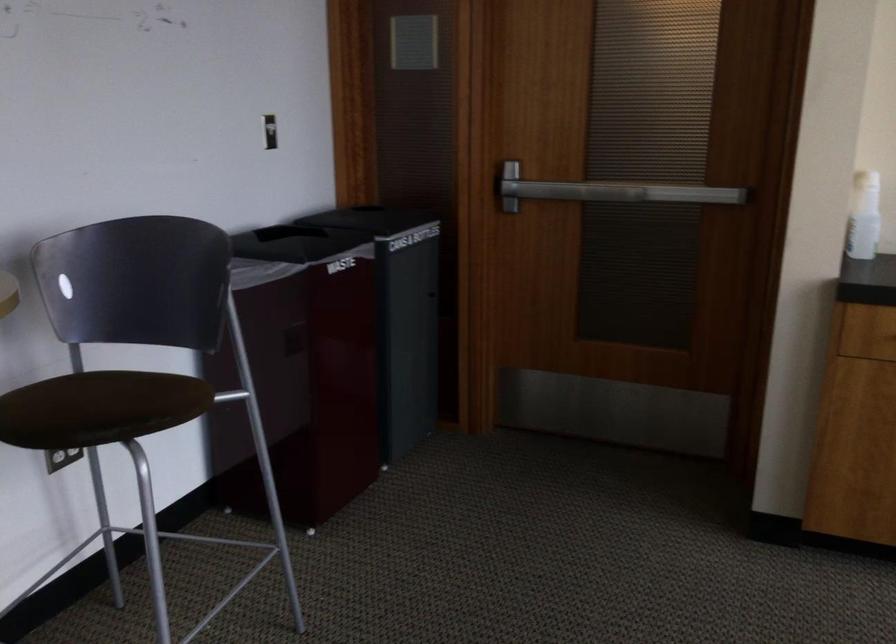
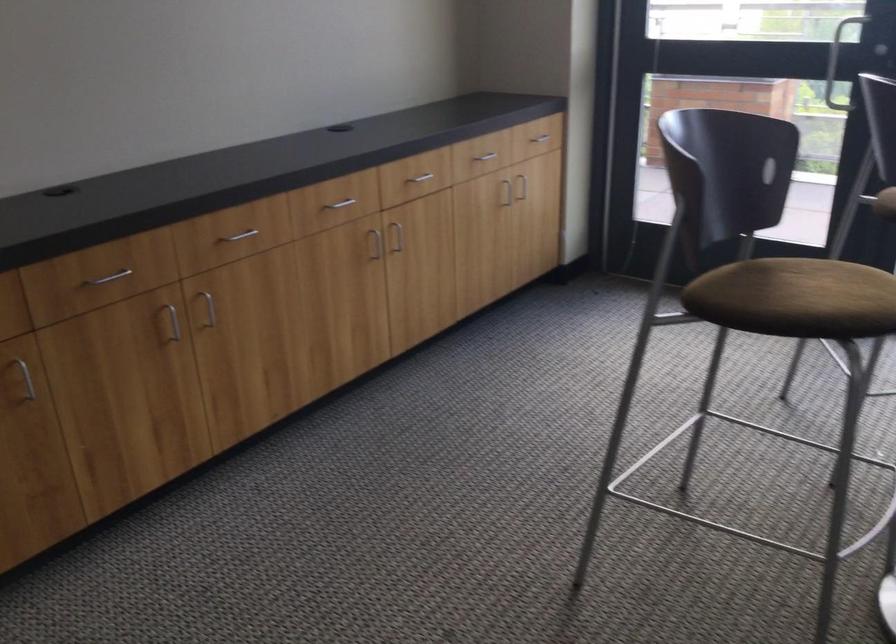
How did the camera likely rotate?

The rotation direction of the camera is right-down.